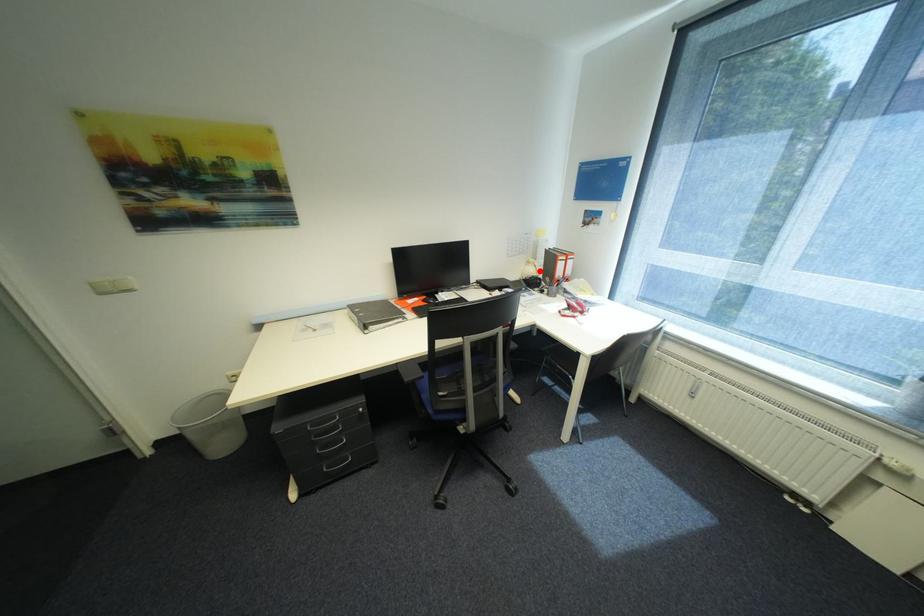
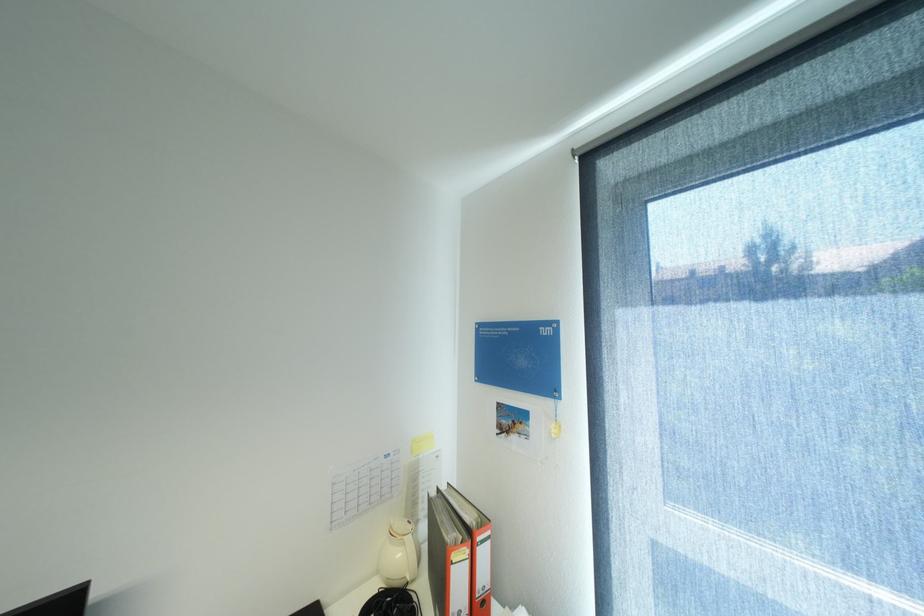
Question: I am providing you with two images of the same scene from different viewpoints. Image1 has a red point marked. In image2, the corresponding 3D location appears at what relative position? Reply with the corresponding letter.

Choices:
 (A) Closer
 (B) Farther

Answer: (B)